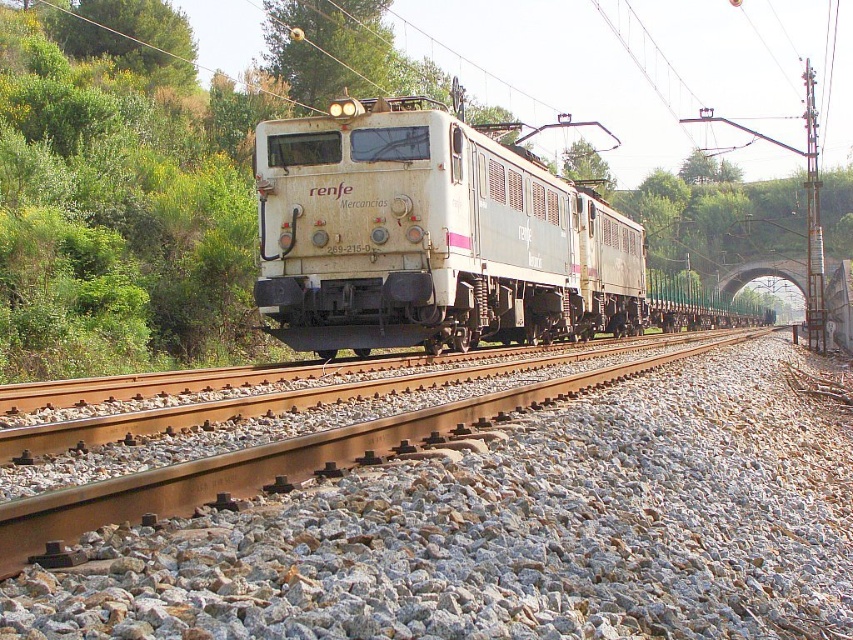
Question: Considering the relative positions of gray gravel at center and white matte train at center in the image provided, where is gray gravel at center located with respect to white matte train at center?

Choices:
 (A) above
 (B) below

Answer: (B)

Question: Among these objects, which one is farthest from the camera?

Choices:
 (A) white matte train at center
 (B) gray gravel at center

Answer: (A)

Question: Does gray gravel at center appear on the right side of white matte train at center?

Choices:
 (A) no
 (B) yes

Answer: (A)

Question: Observing the image, what is the correct spatial positioning of gray gravel at center in reference to white matte train at center?

Choices:
 (A) above
 (B) below

Answer: (B)

Question: Which point appears closest to the camera in this image?

Choices:
 (A) (550, 540)
 (B) (416, 170)

Answer: (A)